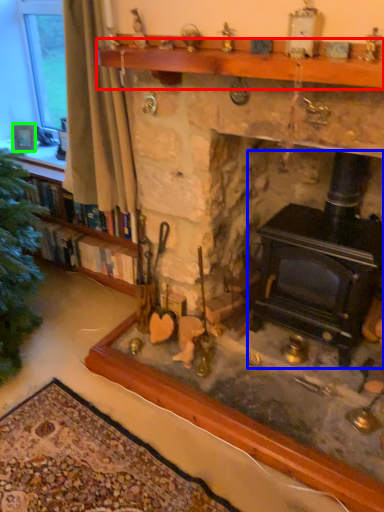
Question: Based on their relative distances, which object is farther from mantle (highlighted by a red box)? Choose from wood burning stove (highlighted by a blue box) and picture frame (highlighted by a green box).

Choices:
 (A) wood burning stove
 (B) picture frame

Answer: (B)